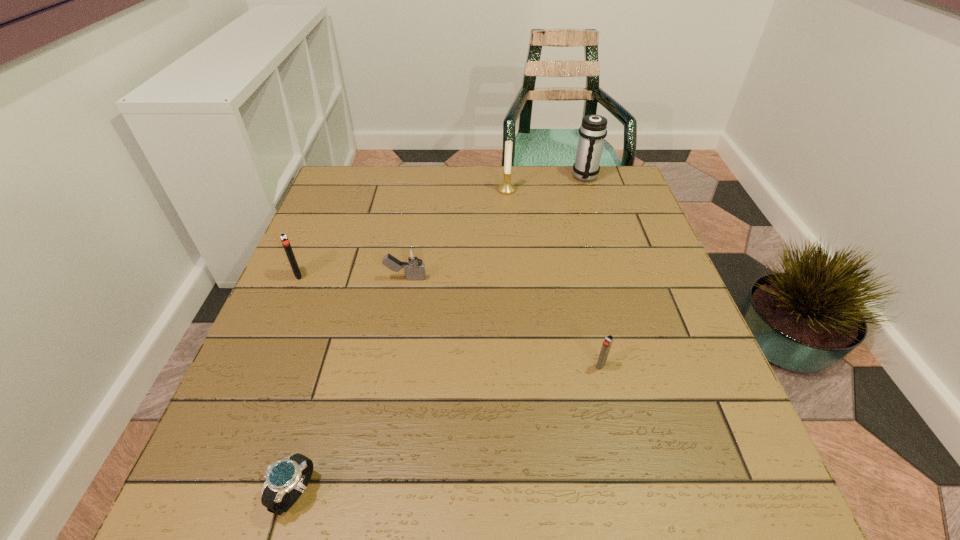
Image resolution: width=960 pixels, height=540 pixels. I want to click on vacant space situated 0.090m on the side with the handle of the thermos bottle, so click(x=593, y=202).

Identify the location of vacant region located 0.300m on the right of the second tallest object. The height and width of the screenshot is (540, 960). (616, 190).

I want to click on vacant space situated 0.080m on the back of the leftmost object, so click(309, 248).

The height and width of the screenshot is (540, 960). Identify the location of blank space located on the front of the second igniter from left to right. (396, 337).

The width and height of the screenshot is (960, 540). I want to click on free space located 0.280m on the left of the second shortest object, so click(x=452, y=366).

Identify the location of vacant space located on the back of the shortest object. The image size is (960, 540). (337, 348).

The image size is (960, 540). What are the coordinates of `thermos bottle that is at the far edge` in the screenshot? It's located at (593, 130).

Where is `candle holder located at the far edge`? Image resolution: width=960 pixels, height=540 pixels. candle holder located at the far edge is located at coordinates 506,188.

The height and width of the screenshot is (540, 960). Identify the location of object that is at the near edge. (291, 475).

You are a GUI agent. You are given a task and a screenshot of the screen. Output one action in this format:
    pyautogui.click(x=<x>, y=<y>)
    Task: Click on the igniter present at the left edge
    
    Given the screenshot: What is the action you would take?
    pyautogui.click(x=283, y=237)